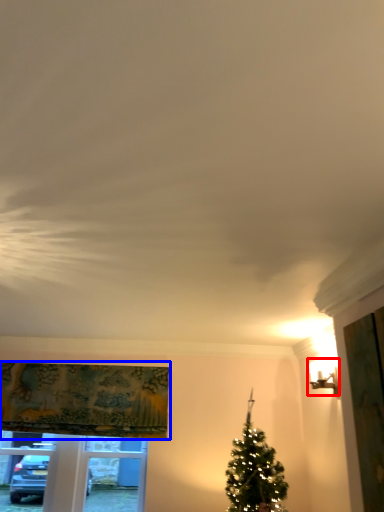
Question: Which object appears farthest to the camera in this image, light fixture (highlighted by a red box) or curtain (highlighted by a blue box)?

Choices:
 (A) light fixture
 (B) curtain

Answer: (B)